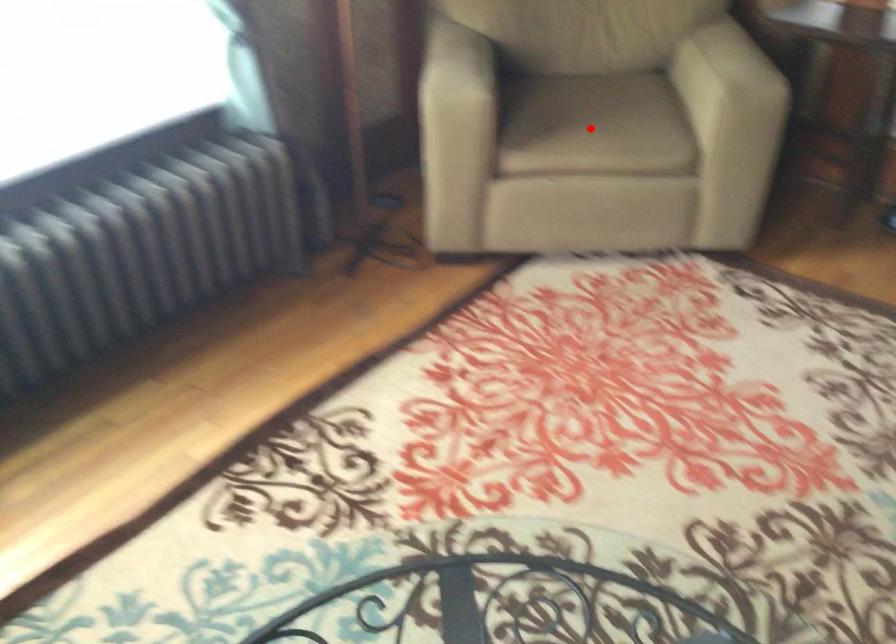
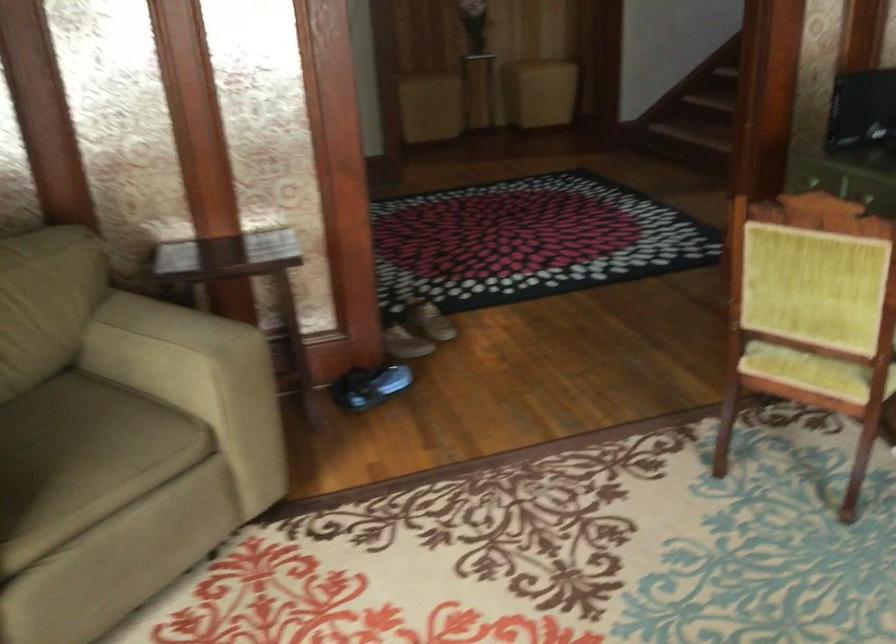
Find the pixel in the second image that matches the highlighted location in the first image.

(82, 459)